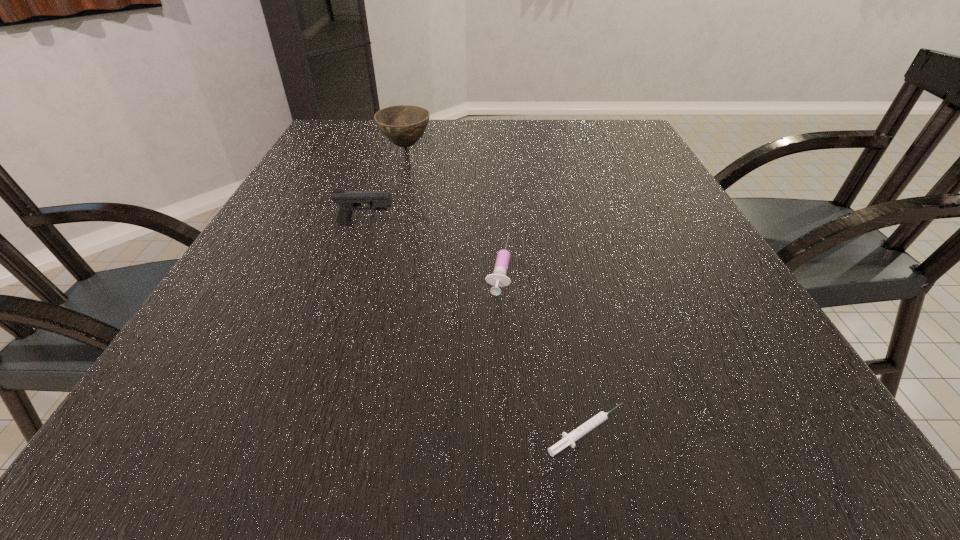
Find the location of a particular element. The height and width of the screenshot is (540, 960). object at the far edge is located at coordinates (403, 125).

I want to click on object that is at the near edge, so click(568, 439).

Identify the location of object that is at the left edge. (348, 201).

The height and width of the screenshot is (540, 960). I want to click on free point at the far edge, so click(x=426, y=129).

Identify the location of free location at the near edge of the desktop. (715, 453).

Find the location of `free space at the left edge of the desktop`. free space at the left edge of the desktop is located at coordinates (348, 166).

At what (x,y) coordinates should I click in order to perform the action: click on vacant space at the right edge of the desktop. Please return your answer as a coordinate pair (x, y). This screenshot has height=540, width=960. Looking at the image, I should click on (708, 262).

In the image, there is a desktop. Where is `vacant space at the far left corner`? vacant space at the far left corner is located at coordinates (354, 118).

You are a GUI agent. You are given a task and a screenshot of the screen. Output one action in this format:
    pyautogui.click(x=<x>, y=<y>)
    Task: Click on the vacant space in between the nearest object and the second nearest object
    
    Given the screenshot: What is the action you would take?
    pyautogui.click(x=542, y=349)

Locate an element on the screen. unoccupied area between the second farthest object and the taller syringe is located at coordinates (432, 245).